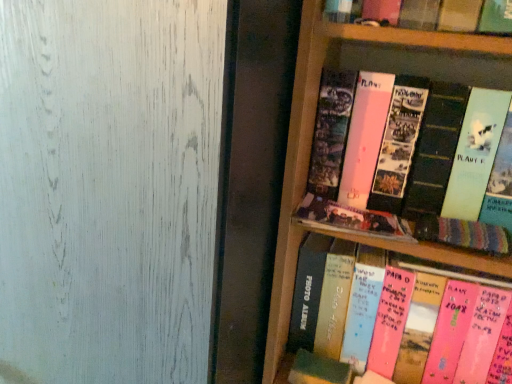
Question: Should I look upward or downward to see knitted fabric book at right, which appears as the second book when ordered from the bottom?

Choices:
 (A) up
 (B) down

Answer: (B)

Question: Is pink matte photo album at upper right, acting as the 1th book starting from the top, beside transparent frosted glass at upper left?

Choices:
 (A) no
 (B) yes

Answer: (A)

Question: From a real-world perspective, is pink matte photo album at upper right, which is counted as the fourth book, starting from the bottom, located higher than transparent frosted glass at upper left?

Choices:
 (A) yes
 (B) no

Answer: (A)

Question: Considering the relative positions of pink matte photo album at upper right, acting as the 1th book starting from the top, and transparent frosted glass at upper left in the image provided, is pink matte photo album at upper right, acting as the 1th book starting from the top, to the right of transparent frosted glass at upper left from the viewer's perspective?

Choices:
 (A) no
 (B) yes

Answer: (B)

Question: Is pink matte photo album at upper right, which is counted as the fourth book, starting from the bottom, at the left side of transparent frosted glass at upper left?

Choices:
 (A) yes
 (B) no

Answer: (B)

Question: Is pink matte photo album at upper right, acting as the 1th book starting from the top, oriented towards transparent frosted glass at upper left?

Choices:
 (A) yes
 (B) no

Answer: (B)

Question: Does pink matte photo album at upper right, acting as the 1th book starting from the top, have a greater width compared to transparent frosted glass at upper left?

Choices:
 (A) yes
 (B) no

Answer: (B)

Question: Are matte black photo album at center, which appears as the second book when viewed from the top, and pink matte photo album at upper right, which is counted as the fourth book, starting from the bottom, far apart?

Choices:
 (A) no
 (B) yes

Answer: (A)

Question: Is matte black photo album at center, which appears as the second book when viewed from the top, taller than pink matte photo album at upper right, which is counted as the fourth book, starting from the bottom?

Choices:
 (A) no
 (B) yes

Answer: (A)

Question: Considering the relative positions of matte black photo album at center, marked as the third book in a bottom-to-top arrangement, and pink matte photo album at upper right, acting as the 1th book starting from the top, in the image provided, is matte black photo album at center, marked as the third book in a bottom-to-top arrangement, behind pink matte photo album at upper right, acting as the 1th book starting from the top,?

Choices:
 (A) yes
 (B) no

Answer: (A)

Question: From a real-world perspective, is matte black photo album at center, which appears as the second book when viewed from the top, over pink matte photo album at upper right, which is counted as the fourth book, starting from the bottom?

Choices:
 (A) no
 (B) yes

Answer: (A)

Question: Is matte black photo album at center, marked as the third book in a bottom-to-top arrangement, aimed at pink matte photo album at upper right, which is counted as the fourth book, starting from the bottom?

Choices:
 (A) no
 (B) yes

Answer: (A)

Question: Is matte black photo album at center, which appears as the second book when viewed from the top, positioned in front of pink matte photo album at upper right, acting as the 1th book starting from the top?

Choices:
 (A) no
 (B) yes

Answer: (A)

Question: Is pink matte photo album at upper right, acting as the 1th book starting from the top, next to pink paper photo album at center, which ranks as the fourth book in top-to-bottom order?

Choices:
 (A) yes
 (B) no

Answer: (B)